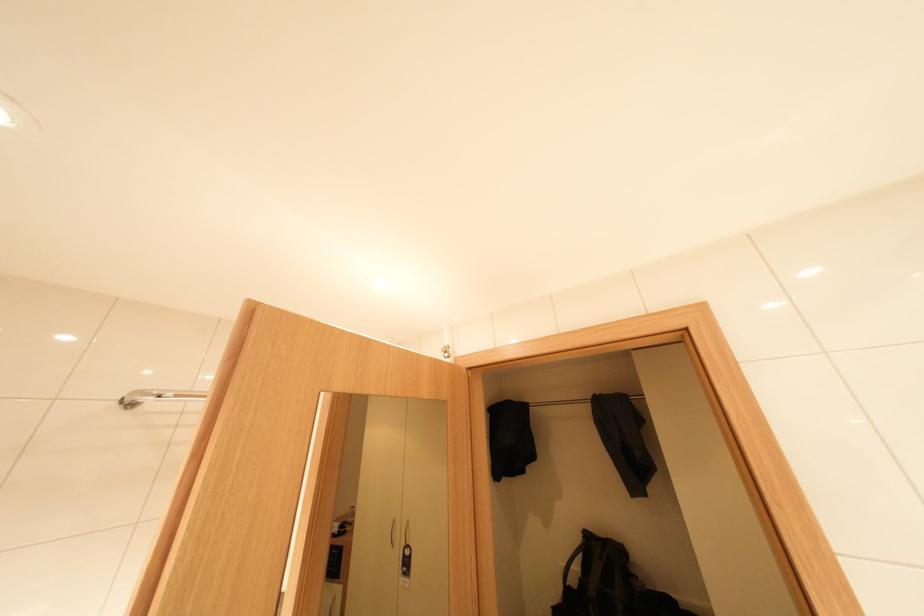
Locate an element on the screen. Image resolution: width=924 pixels, height=616 pixels. wooden door edge is located at coordinates (593, 338).